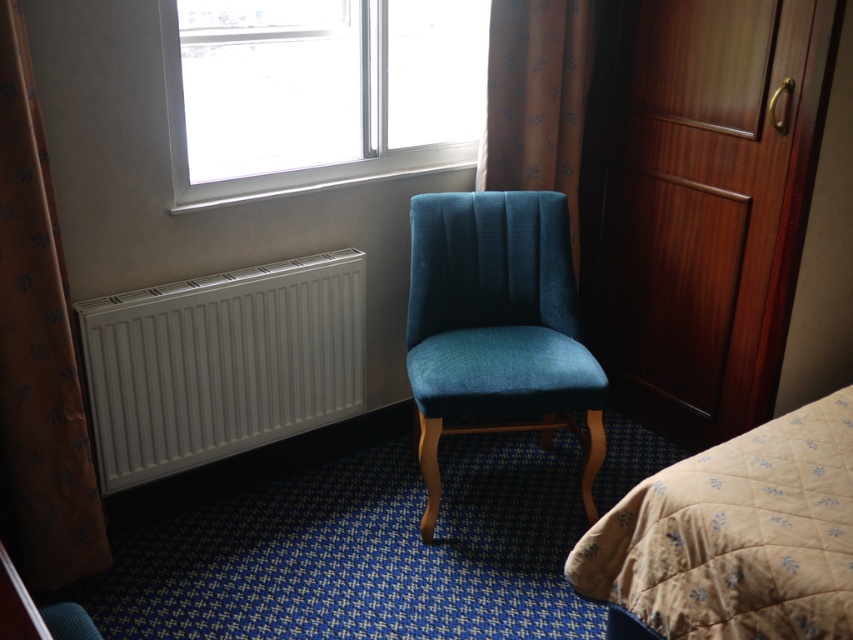
Question: Which object is closer to the camera taking this photo?

Choices:
 (A) clear glass window at upper center
 (B) white matte radiator at lower left

Answer: (B)

Question: Is brown fabric curtain at left further to camera compared to velvet dark blue curtain at upper center?

Choices:
 (A) yes
 (B) no

Answer: (B)

Question: Does white matte radiator at lower left lie behind brown fabric curtain at left?

Choices:
 (A) yes
 (B) no

Answer: (A)

Question: Does clear glass window at upper center appear over beige quilted bed at lower right?

Choices:
 (A) no
 (B) yes

Answer: (B)

Question: Among these objects, which one is nearest to the camera?

Choices:
 (A) velvet dark blue curtain at upper center
 (B) white matte radiator at lower left

Answer: (B)

Question: Which of the following is the farthest from the observer?

Choices:
 (A) brown fabric curtain at left
 (B) velvet dark blue curtain at upper center

Answer: (B)